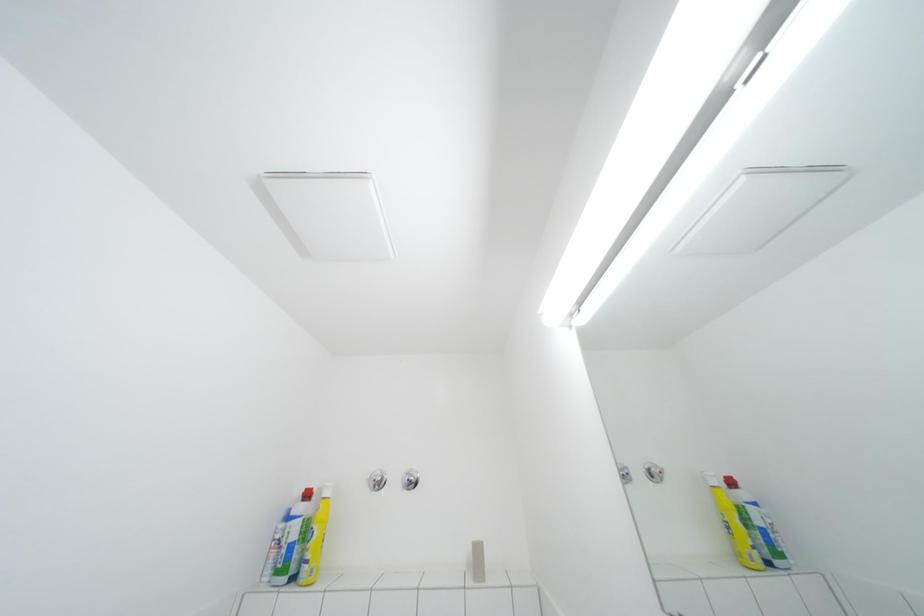
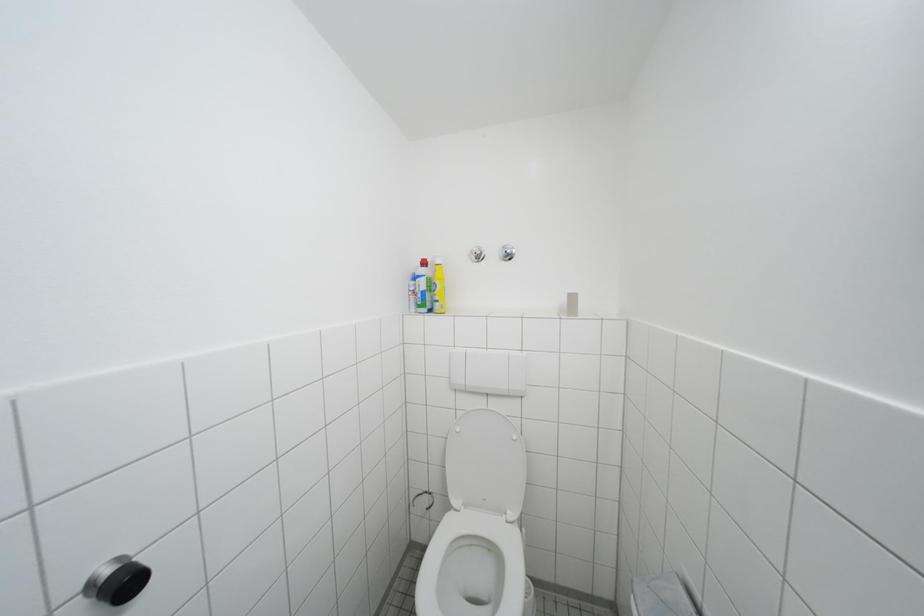
The first image is from the beginning of the video and the second image is from the end. How did the camera likely rotate when shooting the video?

The camera rotated toward left-down.